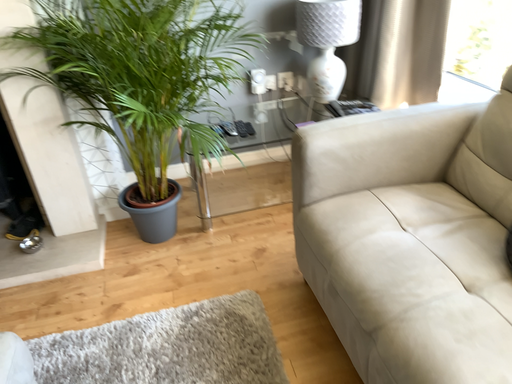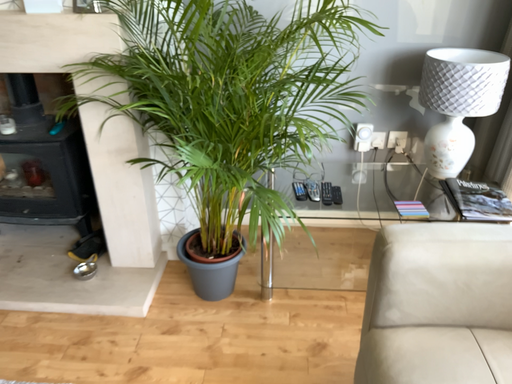
Question: How did the camera likely rotate when shooting the video?

Choices:
 (A) rotated left
 (B) rotated right

Answer: (A)